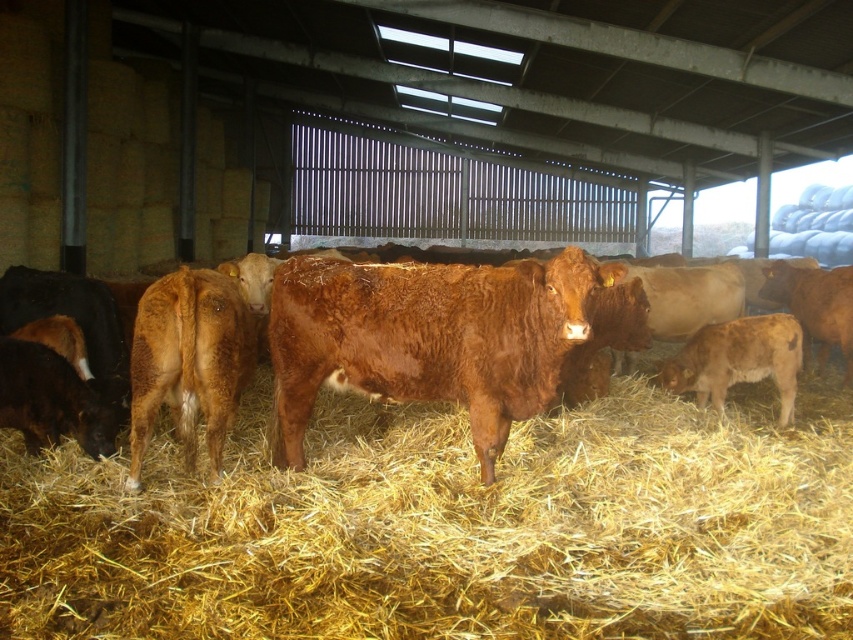
You are a farmer checking the barn. You see the yellow straw at center and the brown furry bull at center. Which object is positioned to the right of the other?

The yellow straw at center is to the right of brown furry bull at center.

You are a farmer checking the barn. You see the brown furry cow at center and the brown furry calf at lower right. Which one is positioned more to the left side of the barn?

The brown furry cow at center is positioned more to the left side of the barn than the brown furry calf at lower right.